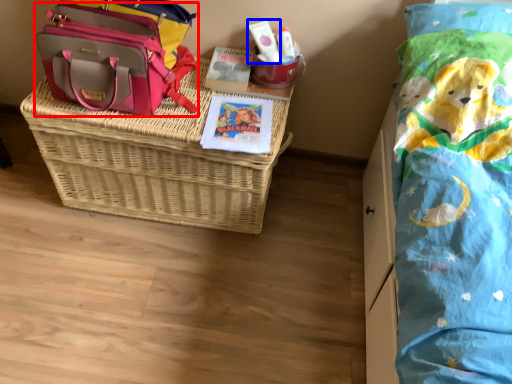
Question: Which of the following is the farthest to the observer, shoulder bag (highlighted by a red box) or toiletry (highlighted by a blue box)?

Choices:
 (A) shoulder bag
 (B) toiletry

Answer: (B)